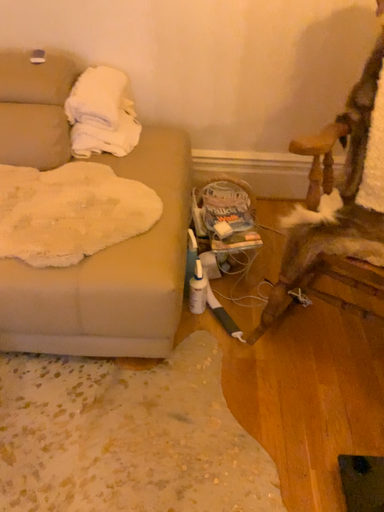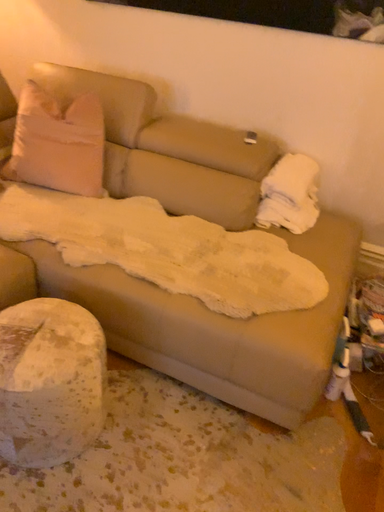
Question: Which way did the camera rotate in the video?

Choices:
 (A) rotated right
 (B) rotated left

Answer: (B)